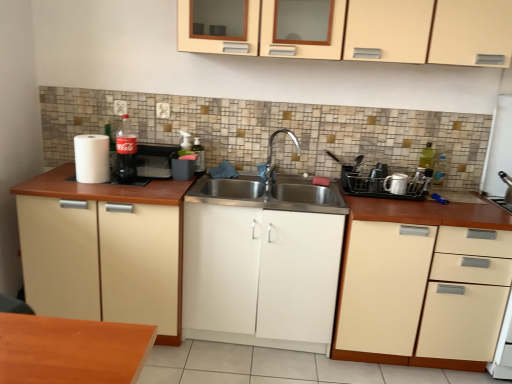
Question: From a real-world perspective, is beige matte cabinet at left, positioned as the 1th cabinetry in left-to-right order, on black plastic dish rack at right, which is the second appliance in left-to-right order?

Choices:
 (A) yes
 (B) no

Answer: (B)

Question: From the image's perspective, is beige matte cabinet at left, acting as the 4th cabinetry starting from the right, located above black plastic dish rack at right, which is the second appliance in right-to-left order?

Choices:
 (A) yes
 (B) no

Answer: (B)

Question: Does beige matte cabinet at left, positioned as the 1th cabinetry in left-to-right order, have a lesser height compared to black plastic dish rack at right, which is the second appliance in left-to-right order?

Choices:
 (A) no
 (B) yes

Answer: (A)

Question: Is beige matte cabinet at left, acting as the 4th cabinetry starting from the right, wider than black plastic dish rack at right, which is the second appliance in left-to-right order?

Choices:
 (A) no
 (B) yes

Answer: (B)

Question: Considering the relative sizes of beige matte cabinet at left, acting as the 4th cabinetry starting from the right, and black plastic dish rack at right, which is the second appliance in left-to-right order, in the image provided, is beige matte cabinet at left, acting as the 4th cabinetry starting from the right, taller than black plastic dish rack at right, which is the second appliance in left-to-right order,?

Choices:
 (A) yes
 (B) no

Answer: (A)

Question: Considering the relative sizes of beige matte cabinet at left, acting as the 4th cabinetry starting from the right, and black plastic dish rack at right, which is the second appliance in right-to-left order, in the image provided, is beige matte cabinet at left, acting as the 4th cabinetry starting from the right, thinner than black plastic dish rack at right, which is the second appliance in right-to-left order,?

Choices:
 (A) yes
 (B) no

Answer: (B)

Question: Is polished stainless steel faucet at center outside of white matte paper towel at left?

Choices:
 (A) no
 (B) yes

Answer: (B)

Question: Does polished stainless steel faucet at center have a larger size compared to white matte paper towel at left?

Choices:
 (A) yes
 (B) no

Answer: (A)

Question: Is white matte paper towel at left surrounded by polished stainless steel faucet at center?

Choices:
 (A) no
 (B) yes

Answer: (A)

Question: Can you confirm if polished stainless steel faucet at center is positioned to the right of white matte paper towel at left?

Choices:
 (A) yes
 (B) no

Answer: (A)

Question: From a real-world perspective, is polished stainless steel faucet at center located beneath white matte paper towel at left?

Choices:
 (A) yes
 (B) no

Answer: (B)

Question: Is polished stainless steel faucet at center far away from white matte paper towel at left?

Choices:
 (A) no
 (B) yes

Answer: (A)

Question: Can you confirm if white matte paper towel at left is positioned to the right of white glossy mug at right, the 3th appliance in the left-to-right sequence?

Choices:
 (A) no
 (B) yes

Answer: (A)